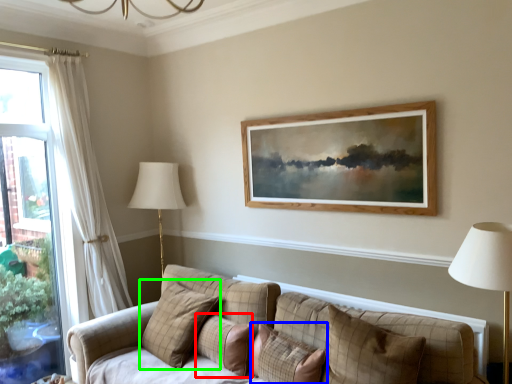
Question: Which object is the farthest from pillow (highlighted by a red box)? Choose among these: pillow (highlighted by a blue box) or pillow (highlighted by a green box).

Choices:
 (A) pillow
 (B) pillow

Answer: (B)